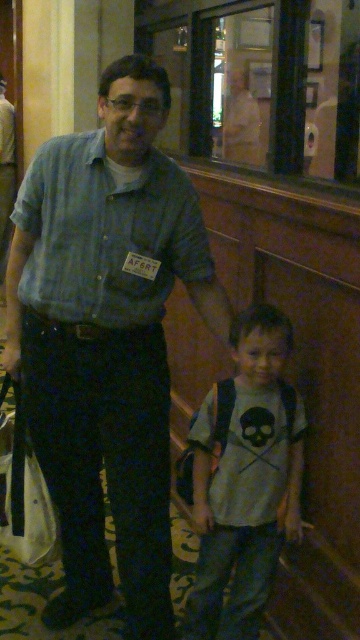
Question: Can you confirm if blue striped shirt at center is positioned above blue denim shirt at center?

Choices:
 (A) yes
 (B) no

Answer: (B)

Question: Estimate the real-world distances between objects in this image. Which object is farther from the blue denim shirt at center?

Choices:
 (A) blue striped shirt at center
 (B) gray cotton t-shirt at center

Answer: (B)

Question: Can you confirm if blue striped shirt at center is positioned below blue denim shirt at center?

Choices:
 (A) no
 (B) yes

Answer: (B)

Question: Which point is farther to the camera?

Choices:
 (A) blue striped shirt at center
 (B) blue denim shirt at center
 (C) gray cotton t-shirt at center

Answer: (C)

Question: Which of the following is the farthest from the observer?

Choices:
 (A) blue denim shirt at center
 (B) blue striped shirt at center
 (C) gray cotton t-shirt at center

Answer: (C)

Question: Does blue striped shirt at center appear over blue denim shirt at center?

Choices:
 (A) yes
 (B) no

Answer: (B)